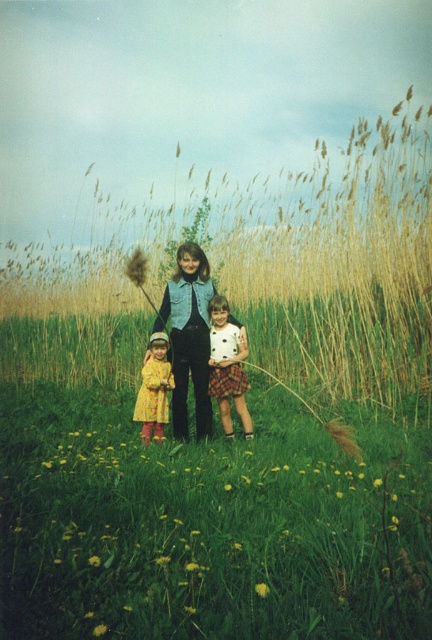
You are planning to take a photo of the denim vest at center and the yellow cotton dress at center. Which one appears wider in the photo?

The denim vest at center appears wider because its width is larger than that of the yellow cotton dress at center.

You are a photographer trying to capture a candid shot of the two people in the scene. The denim vest at center and the yellow cotton dress at center are your subjects. Given that your camera lens can only focus on objects up to 1.5 meters tall, will both subjects be in focus?

The denim vest at center is taller than the yellow cotton dress at center. Since the camera lens can focus up to 1.5 meters, if the denim vest at center is taller than 1.5 meters, it might be out of focus, but the yellow cotton dress at center would likely be in focus if it is shorter. However, without exact height measurements, we cannot confirm both will be in focus.